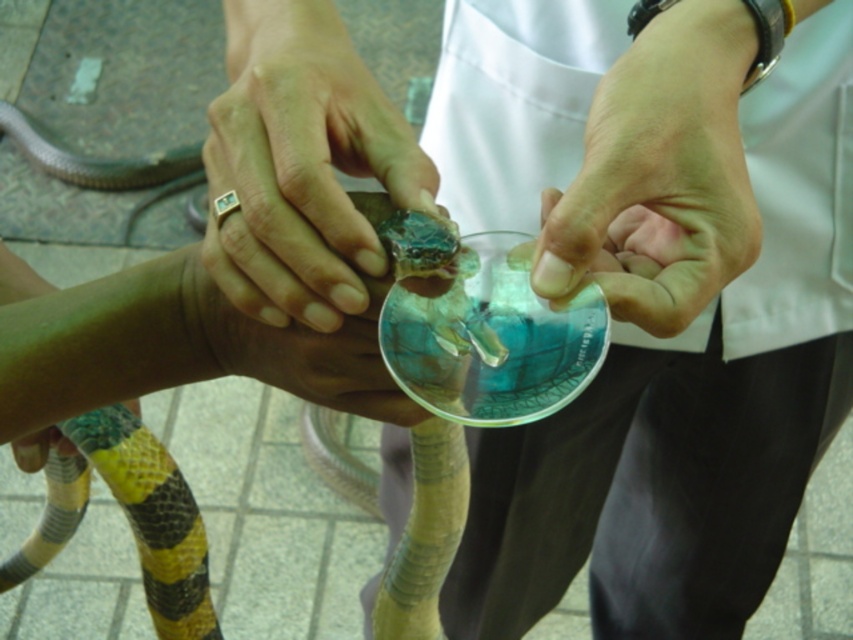
Looking at this image, you are a researcher analyzing the image of two people interacting with a snake. You need to determine if the gold ring at center is located at the coordinates point (x=300, y=164). Based on the image description, can you confirm this?

Yes, the point (x=300, y=164) is on the gold ring at center, so the gold ring at center is located at those coordinates.